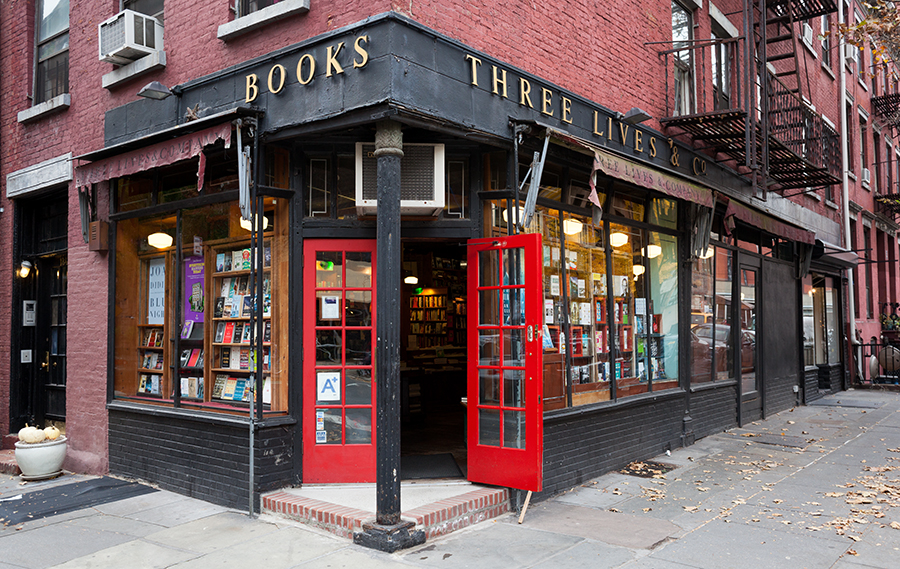
This screenshot has height=569, width=900. What are the coordinates of `bookshelf` in the screenshot? It's located at (157, 338), (217, 331).